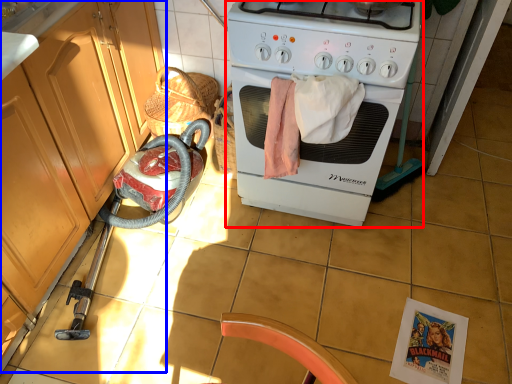
Question: Which object appears farthest to the camera in this image, home appliance (highlighted by a red box) or cabinetry (highlighted by a blue box)?

Choices:
 (A) home appliance
 (B) cabinetry

Answer: (A)